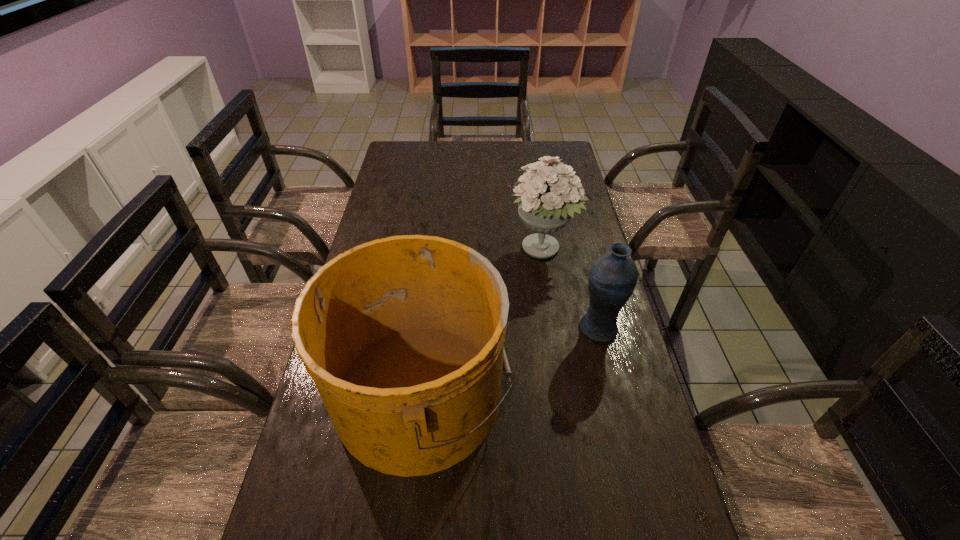
Image resolution: width=960 pixels, height=540 pixels. What are the coordinates of `vacant space that is in between the vase and the leftmost object` in the screenshot? It's located at click(x=510, y=360).

This screenshot has width=960, height=540. I want to click on object that stands as the second closest to the bucket, so click(x=613, y=276).

The width and height of the screenshot is (960, 540). In order to click on object that is the second closest to the vase in this screenshot , I will do `click(403, 336)`.

I want to click on free point that satisfies the following two spatial constraints: 1. on the front side of the farthest object; 2. on the right side of the vase, so click(556, 328).